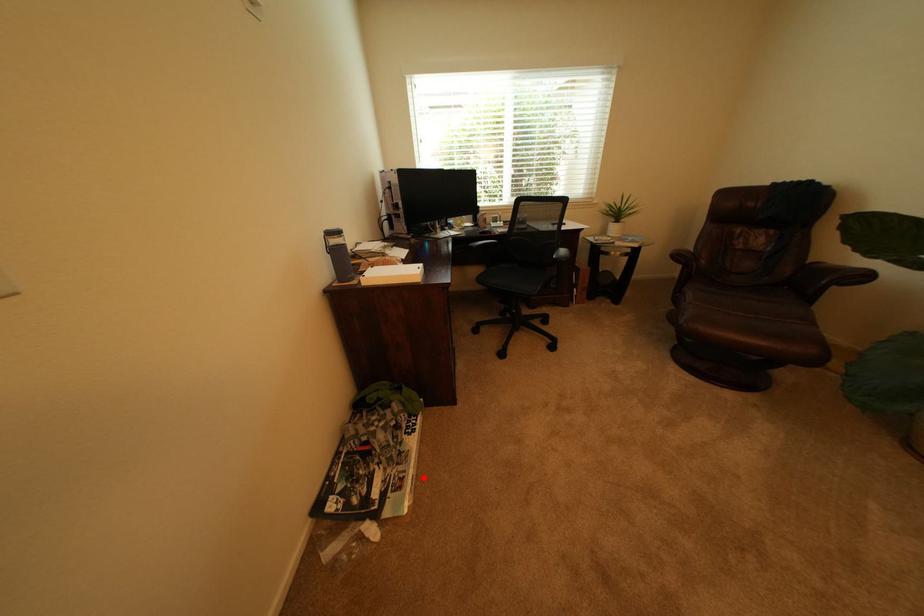
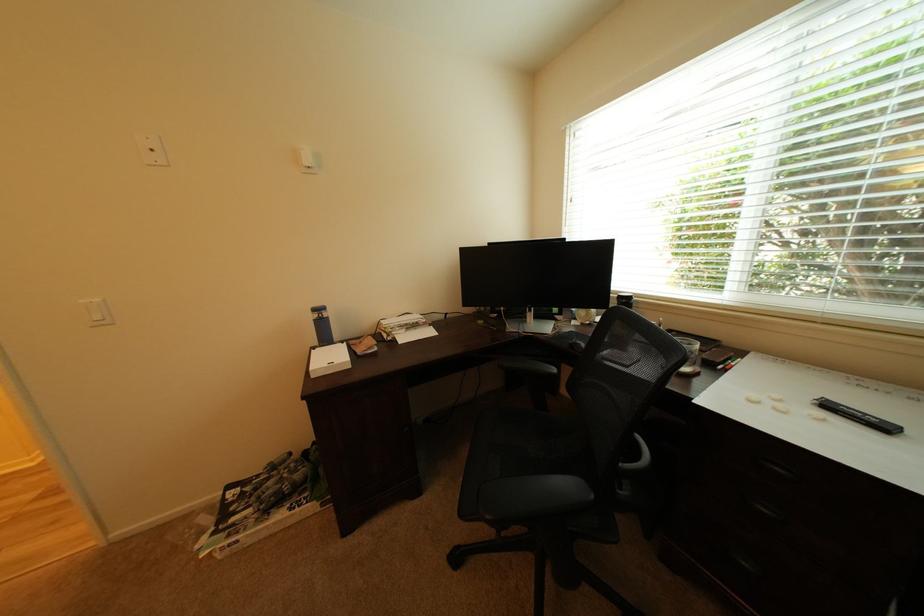
Question: I am providing you with two images of the same scene from different viewpoints. Given a red point in image1, look at the same physical point in image2. Is it:

Choices:
 (A) Closer to the viewpoint
 (B) Farther from the viewpoint

Answer: (B)